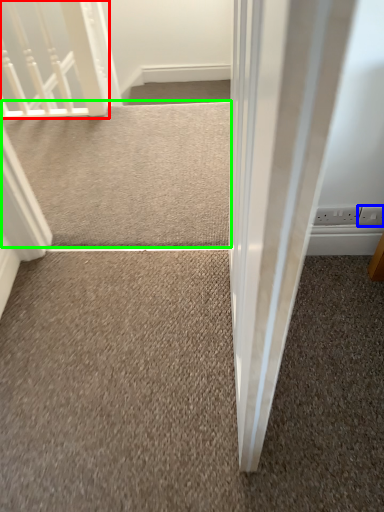
Question: Which object is positioned closest to rail (highlighted by a red box)? Select from electric outlet (highlighted by a blue box) and doormat (highlighted by a green box).

Choices:
 (A) electric outlet
 (B) doormat

Answer: (B)